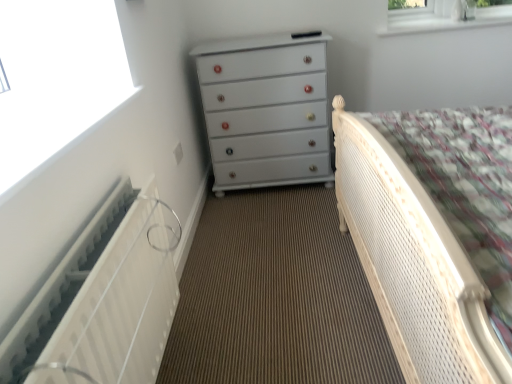
What do you see at coordinates (56, 78) in the screenshot? The height and width of the screenshot is (384, 512). I see `white glossy radiator at left` at bounding box center [56, 78].

Where is `white textured radiator at left`? This screenshot has height=384, width=512. white textured radiator at left is located at coordinates (104, 300).

Where is `white glossy radiator at left`? This screenshot has width=512, height=384. white glossy radiator at left is located at coordinates (56, 78).

Is the surface of white cane bed at right in direct contact with white glossy chest of drawers at center?

No, white cane bed at right is not with white glossy chest of drawers at center.

Can you confirm if white cane bed at right is thinner than white glossy chest of drawers at center?

No, white cane bed at right is not thinner than white glossy chest of drawers at center.

In the scene shown: What's the angular difference between white cane bed at right and white glossy chest of drawers at center's facing directions?

They differ by 90.3 degrees in their facing directions.

From the image's perspective, is white cane bed at right below white glossy chest of drawers at center?

Yes, from the image's perspective, white cane bed at right is beneath white glossy chest of drawers at center.

Can you confirm if white cane bed at right is shorter than white textured radiator at left?

No.

Which is farther, (339, 166) or (13, 335)?

The point (339, 166) is more distant.

From a real-world perspective, is white cane bed at right physically located above or below white textured radiator at left?

From a real-world perspective, white cane bed at right is physically above white textured radiator at left.

In the scene shown: Is white cane bed at right beside white textured radiator at left?

No, white cane bed at right is not beside white textured radiator at left.

Is white textured radiator at left in contact with white glossy chest of drawers at center?

No, white textured radiator at left is not making contact with white glossy chest of drawers at center.

Which object is more forward, white textured radiator at left or white glossy chest of drawers at center?

white textured radiator at left is in front.

The width and height of the screenshot is (512, 384). In order to click on radiator below the white glossy chest of drawers at center (from the image's perspective) in this screenshot , I will do `click(104, 300)`.

From a real-world perspective, is white textured radiator at left located higher than white glossy chest of drawers at center?

No, from a real-world perspective, white textured radiator at left is not on top of white glossy chest of drawers at center.

Considering the positions of points (33, 118) and (308, 92), is point (33, 118) closer to camera compared to point (308, 92)?

Yes, it is.

How many degrees apart are the facing directions of white glossy radiator at left and white glossy chest of drawers at center?

89.7 degrees.

Who is smaller, white glossy radiator at left or white glossy chest of drawers at center?

With smaller size is white glossy radiator at left.

Who is taller, white glossy radiator at left or white glossy chest of drawers at center?

With more height is white glossy chest of drawers at center.

From a real-world perspective, is white cane bed at right on white glossy radiator at left?

No, from a real-world perspective, white cane bed at right is not on top of white glossy radiator at left.

Who is shorter, white cane bed at right or white glossy radiator at left?

With less height is white glossy radiator at left.

Where is `bed that appears in front of the white glossy radiator at left`? The width and height of the screenshot is (512, 384). bed that appears in front of the white glossy radiator at left is located at coordinates (413, 263).

Considering the sizes of white cane bed at right and white glossy radiator at left in the image, is white cane bed at right bigger or smaller than white glossy radiator at left?

Considering their sizes, white cane bed at right takes up more space than white glossy radiator at left.

Between white glossy chest of drawers at center and white glossy radiator at left, which one has smaller width?

With smaller width is white glossy chest of drawers at center.

Does white glossy chest of drawers at center have a greater height compared to white glossy radiator at left?

Correct, white glossy chest of drawers at center is much taller as white glossy radiator at left.

Considering the positions of objects white glossy chest of drawers at center and white glossy radiator at left in the image provided, who is more to the left, white glossy chest of drawers at center or white glossy radiator at left?

white glossy radiator at left.

Considering the relative sizes of white glossy radiator at left and white textured radiator at left in the image provided, is white glossy radiator at left smaller than white textured radiator at left?

Yes, white glossy radiator at left is smaller than white textured radiator at left.

From the image's perspective, is white glossy radiator at left beneath white textured radiator at left?

No.

Is white glossy radiator at left next to white textured radiator at left and touching it?

No, white glossy radiator at left is not beside white textured radiator at left.

Can you confirm if white glossy radiator at left is positioned to the right of white textured radiator at left?

In fact, white glossy radiator at left is to the left of white textured radiator at left.

This screenshot has width=512, height=384. In order to click on the chest of drawers that is behind the white cane bed at right in this screenshot , I will do `click(266, 110)`.

Find the location of a particular element. The height and width of the screenshot is (384, 512). bed above the white textured radiator at left (from a real-world perspective) is located at coordinates (413, 263).

Looking at the image, which one is located further to white glossy chest of drawers at center, white textured radiator at left or white glossy radiator at left?

white textured radiator at left.

Based on their spatial positions, is white textured radiator at left or white glossy chest of drawers at center closer to white glossy radiator at left?

white textured radiator at left.

Looking at the image, which one is located closer to white textured radiator at left, white glossy chest of drawers at center or white cane bed at right?

white cane bed at right.

From the image, which object appears to be nearer to white cane bed at right, white glossy radiator at left or white textured radiator at left?

Based on the image, white textured radiator at left appears to be nearer to white cane bed at right.

Looking at this image, from the image, which object appears to be nearer to white cane bed at right, white glossy chest of drawers at center or white textured radiator at left?

Based on the image, white textured radiator at left appears to be nearer to white cane bed at right.

Based on their spatial positions, is white glossy radiator at left or white glossy chest of drawers at center closer to white cane bed at right?

white glossy radiator at left lies closer to white cane bed at right than the other object.

From the image, which object appears to be farther from white glossy radiator at left, white glossy chest of drawers at center or white cane bed at right?

white glossy chest of drawers at center lies further to white glossy radiator at left than the other object.

Considering their positions, is white cane bed at right positioned further to white textured radiator at left than white glossy radiator at left?

Among the two, white cane bed at right is located further to white textured radiator at left.

This screenshot has width=512, height=384. What are the coordinates of `radiator situated between white glossy radiator at left and white cane bed at right from left to right` in the screenshot? It's located at (104, 300).

You are a GUI agent. You are given a task and a screenshot of the screen. Output one action in this format:
    pyautogui.click(x=<x>, y=<y>)
    Task: Click on the window between white textured radiator at left and white glossy chest of drawers at center along the z-axis
    The width and height of the screenshot is (512, 384).
    Given the screenshot: What is the action you would take?
    pyautogui.click(x=56, y=78)

The height and width of the screenshot is (384, 512). I want to click on radiator between white cane bed at right and white glossy chest of drawers at center along the z-axis, so click(x=104, y=300).

This screenshot has width=512, height=384. I want to click on window between white cane bed at right and white glossy chest of drawers at center along the z-axis, so click(56, 78).